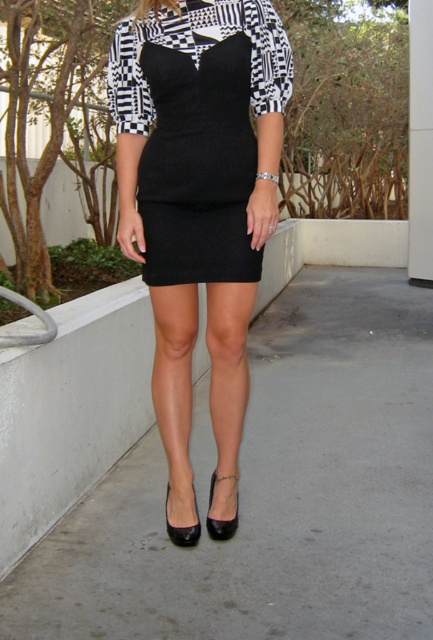
From the picture: You are a photographer setting up for a shoot. You have two markers placed at coordinates point (233,364) and point (412,144). You need to position the model so they are closer to the marker that is behind the other. Which coordinate should the model stand near?

The model should stand near point (412,144) because it is behind point (233,364) according to the spatial arrangement.

You are a fashion designer analyzing the positioning of the satin black dress at center in the image. Based on its coordinates, can you determine if it is positioned closer to the left or right side of the image?

The satin black dress at center is located at point 0.308 on the x and y axis, which places it closer to the left side of the image.